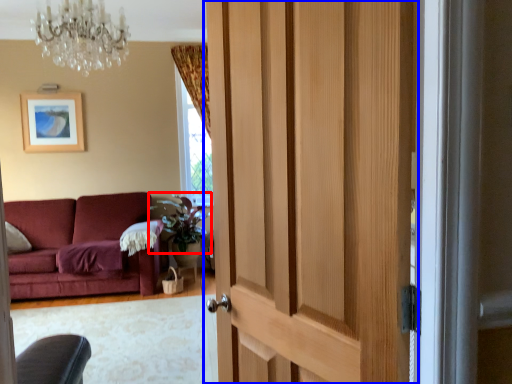
Question: Which object is closer to the camera taking this photo, plant (highlighted by a red box) or door (highlighted by a blue box)?

Choices:
 (A) plant
 (B) door

Answer: (B)